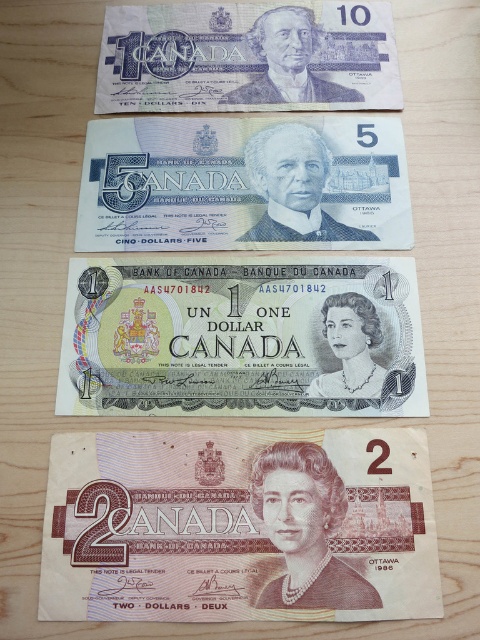
You are a cashier who needs to verify the distance of the light green paper at center from the viewer. According to the provided information, what is the exact distance?

The light green paper at center is exactly 28.40 inches away from the viewer.

You are a bank teller organizing Canadian banknotes. You have two notes in front of you on the counter. One is a light green paper at center and the other is a matte purple banknote at upper center. Which note is physically thinner between the two?

The light green paper at center is thinner than the matte purple banknote at upper center according to the description.

You are arranging Canadian banknotes on a desk and see the light brown paper money at bottom and the blue paper money at center. Which one is positioned to the left of the other?

The light brown paper money at bottom is positioned to the left of the blue paper money at center.